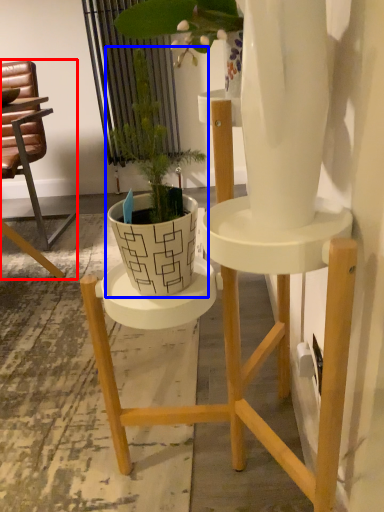
Question: Among these objects, which one is nearest to the camera, chair (highlighted by a red box) or houseplant (highlighted by a blue box)?

Choices:
 (A) chair
 (B) houseplant

Answer: (B)